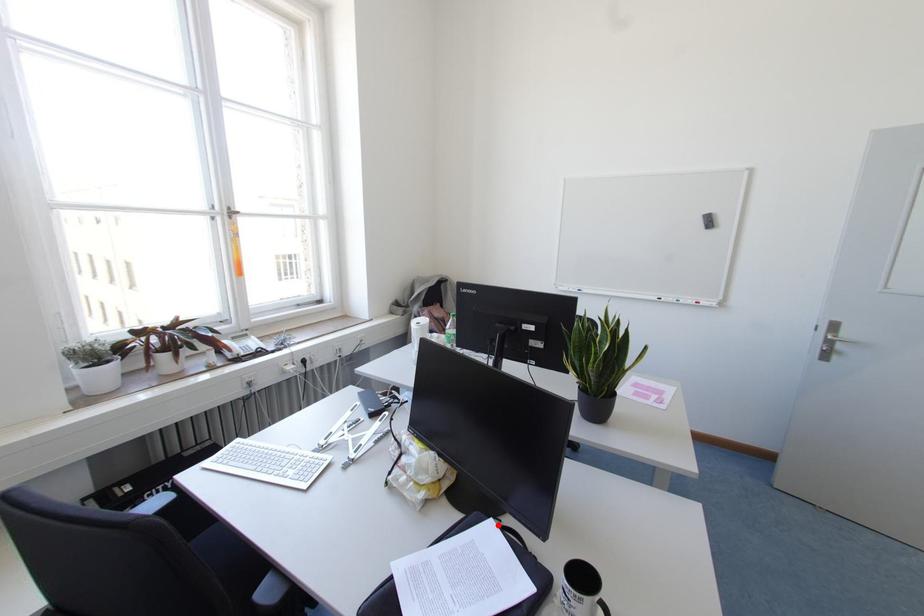
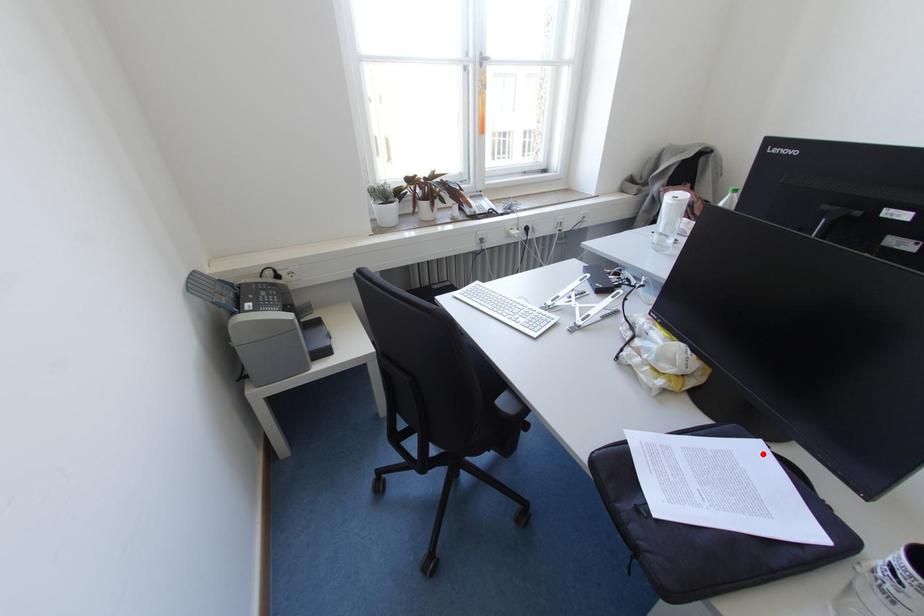
I am providing you with two images of the same scene from different viewpoints. A red point is marked on the first image and another point is marked on the second image. Are the points marked in image1 and image2 representing the same 3D position?

Yes